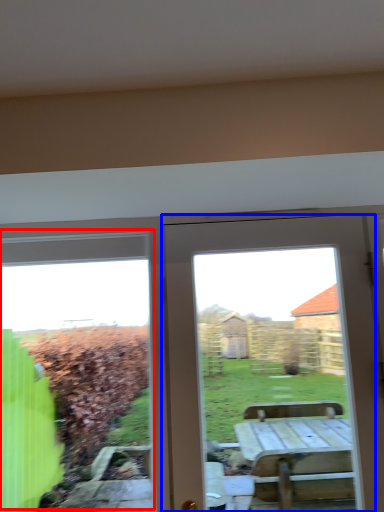
Question: Which object is further to the camera taking this photo, bay window (highlighted by a red box) or door (highlighted by a blue box)?

Choices:
 (A) bay window
 (B) door

Answer: (A)